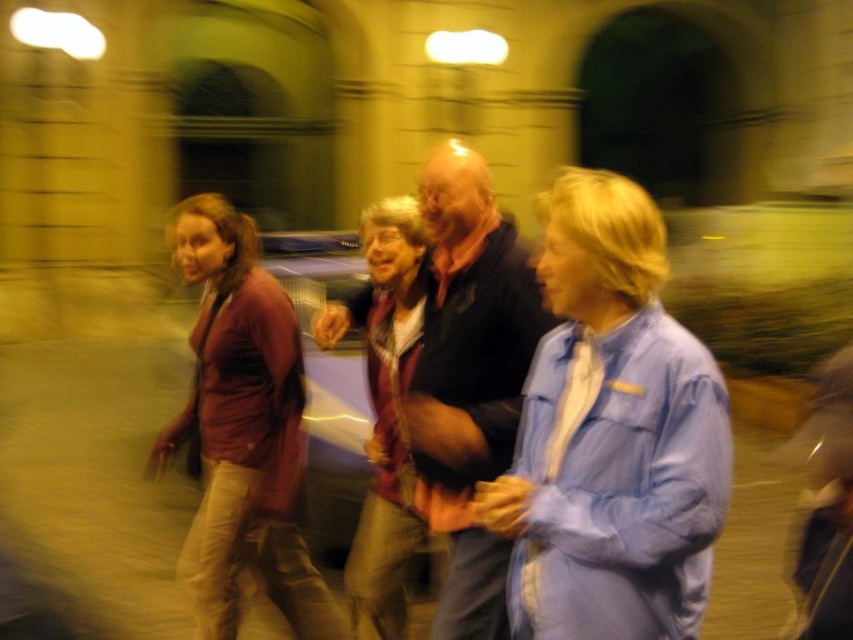
Can you confirm if matte blue shirt at center is taller than dark blue shirt at center?

No, matte blue shirt at center is not taller than dark blue shirt at center.

Is point (550, 333) more distant than point (422, 406)?

No, (550, 333) is closer to viewer.

The image size is (853, 640). In order to click on matte blue shirt at center in this screenshot , I will do `click(611, 435)`.

Looking at this image, how distant is matte blue shirt at center from matte red jacket at center?

matte blue shirt at center is 1.56 meters away from matte red jacket at center.

Is the position of matte blue shirt at center less distant than that of matte red jacket at center?

Yes, it is.

Who is more forward, (657, 360) or (397, 536)?

Point (657, 360)

This screenshot has width=853, height=640. In order to click on matte blue shirt at center in this screenshot , I will do `click(611, 435)`.

Which is above, matte maroon sweater at left or dark blue shirt at center?

dark blue shirt at center is above.

Between matte maroon sweater at left and dark blue shirt at center, which one appears on the left side from the viewer's perspective?

matte maroon sweater at left is more to the left.

Where is `matte maroon sweater at left`? The width and height of the screenshot is (853, 640). matte maroon sweater at left is located at coordinates (242, 432).

The height and width of the screenshot is (640, 853). I want to click on matte maroon sweater at left, so coord(242,432).